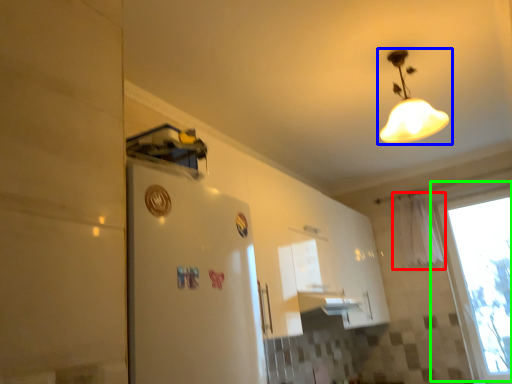
Question: Estimate the real-world distances between objects in this image. Which object is closer to curtain (highlighted by a red box), lamp (highlighted by a blue box) or window (highlighted by a green box)?

Choices:
 (A) lamp
 (B) window

Answer: (B)